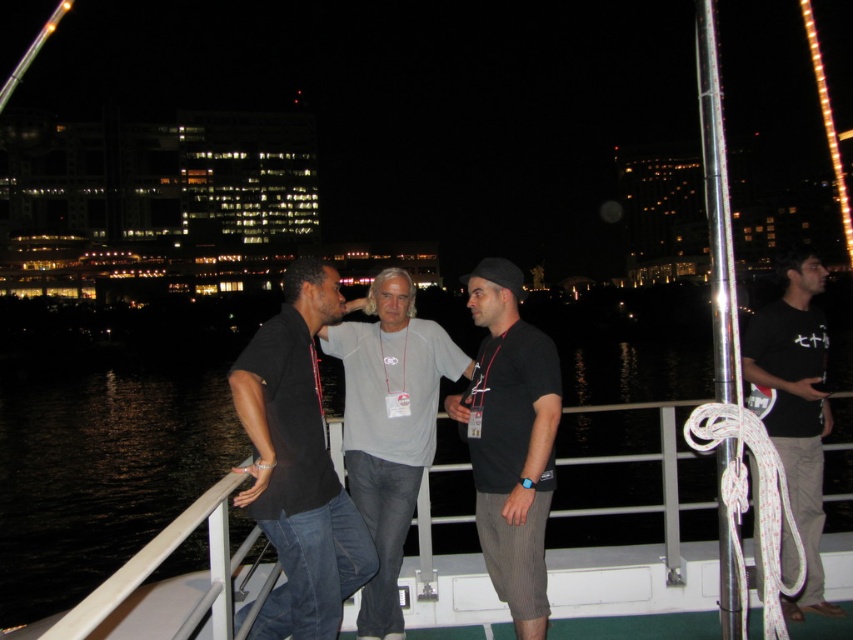
In order to click on black cotton shirt at center in this screenshot , I will do pos(299,465).

Locate an element on the screen. Image resolution: width=853 pixels, height=640 pixels. black cotton shirt at center is located at coordinates (299, 465).

Which is behind, point (258, 353) or point (526, 332)?

Point (526, 332)

Consider the image. Can you confirm if black cotton shirt at center is smaller than black matte t-shirt at center?

Correct, black cotton shirt at center occupies less space than black matte t-shirt at center.

Between point (317, 465) and point (486, 452), which one is positioned behind?

Positioned behind is point (486, 452).

You are a GUI agent. You are given a task and a screenshot of the screen. Output one action in this format:
    pyautogui.click(x=<x>, y=<y>)
    Task: Click on the black cotton shirt at center
    
    Given the screenshot: What is the action you would take?
    pyautogui.click(x=299, y=465)

Based on the photo, who is taller, black matte t-shirt at center or black cotton t-shirt at right?

black matte t-shirt at center is taller.

Is point (543, 536) positioned in front of point (792, 436)?

That is True.

The width and height of the screenshot is (853, 640). Find the location of `black matte t-shirt at center`. black matte t-shirt at center is located at coordinates (509, 440).